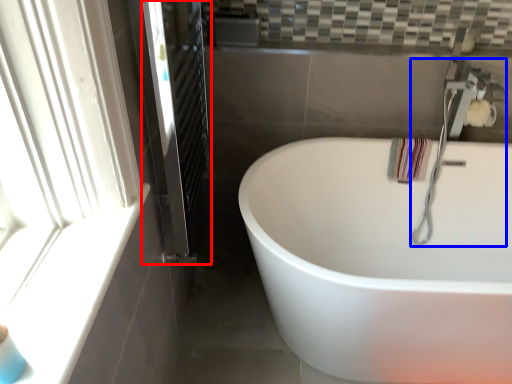
Question: Which of the following is the closest to the observer, screen door (highlighted by a red box) or faucet (highlighted by a blue box)?

Choices:
 (A) screen door
 (B) faucet

Answer: (A)